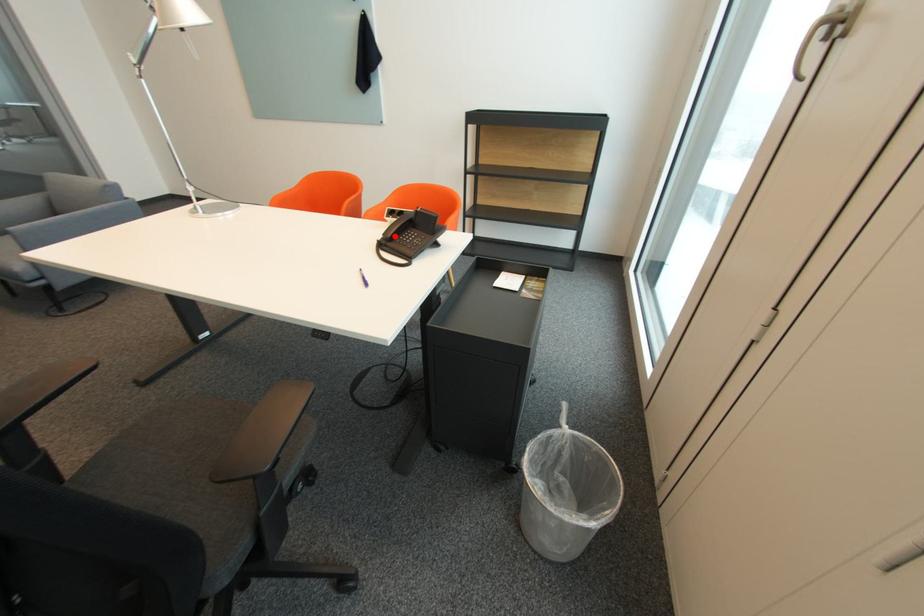
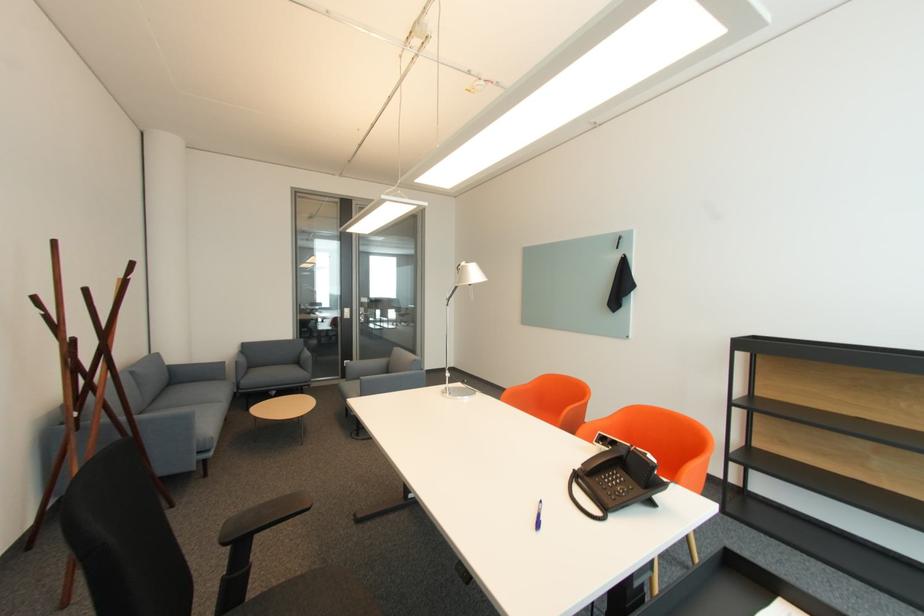
Find the pixel in the second image that matches the highlighted location in the first image.

(594, 469)